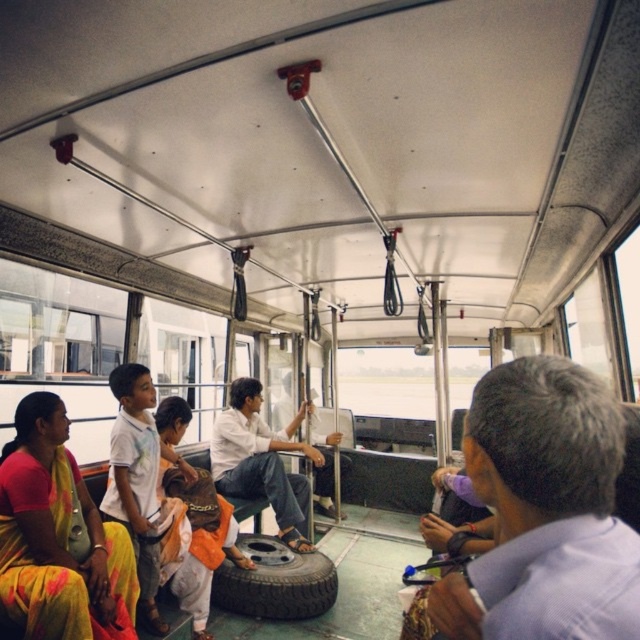
You are a passenger on a bus and you have a yellow cotton saree at lower left that you want to place on the dark gray rubber tire at center. Is the distance between them sufficient to allow you to carry the saree from its current position to the tire without needing to step over any obstacles?

The yellow cotton saree at lower left and dark gray rubber tire at center are 4.58 feet apart from each other. Since there are no mentioned obstacles between them, you can carry the saree directly to the tire.

You are a passenger on a bus and you see a yellow cotton saree at lower left and a white matte shirt at center. Which item is closer to the front of the bus?

The yellow cotton saree at lower left is in front of the white matte shirt at center, so it is closer to the front of the bus.

You are standing at the point with coordinates point (58, 538) in the public transport vehicle. What object is located at that point?

The point (58, 538) corresponds to the yellow cotton saree at lower left.